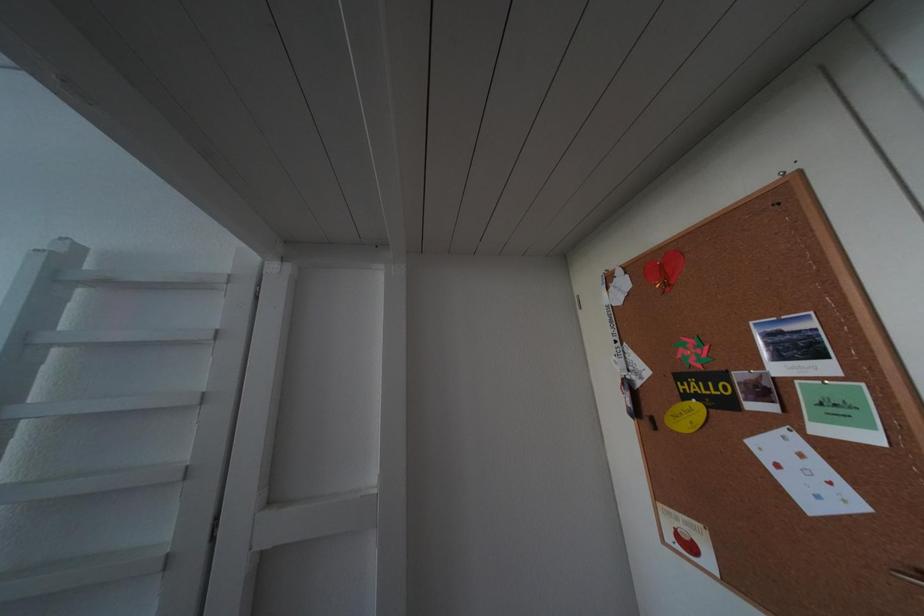
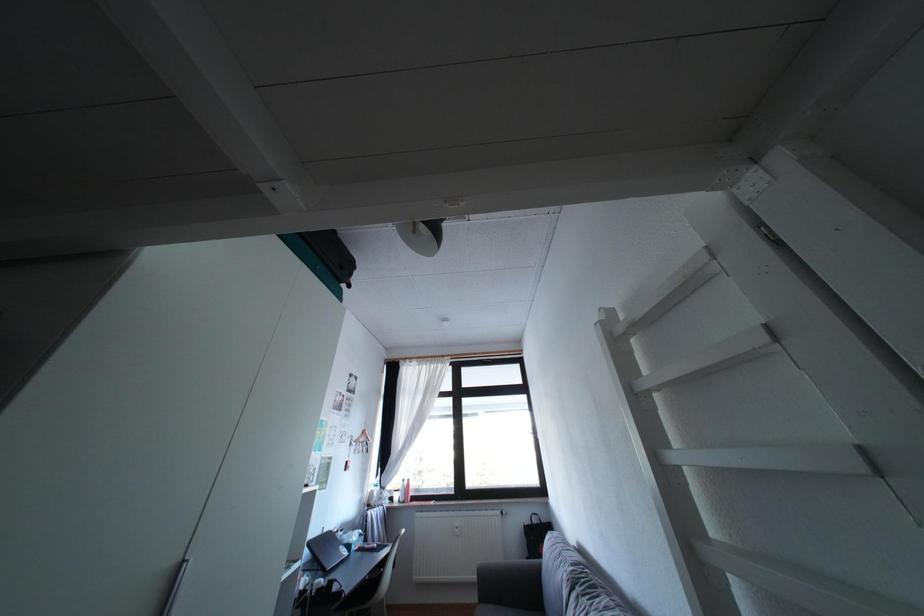
First-person continuous shooting, in which direction is the camera rotating?

The camera rotated toward left-up.